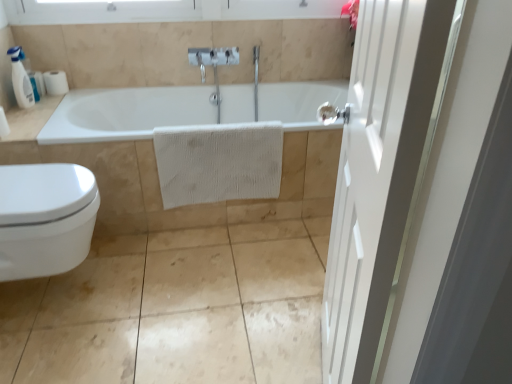
What do you see at coordinates (30, 119) in the screenshot?
I see `white glossy counter top at upper left` at bounding box center [30, 119].

Find the location of a particular element. The height and width of the screenshot is (384, 512). white glossy counter top at upper left is located at coordinates (30, 119).

Is white matte toilet paper at upper left positioned far away from white plastic soap dispenser at upper left?

No, white matte toilet paper at upper left is in close proximity to white plastic soap dispenser at upper left.

Is white matte toilet paper at upper left aimed at white plastic soap dispenser at upper left?

Yes, white matte toilet paper at upper left is oriented towards white plastic soap dispenser at upper left.

From the image's perspective, is white matte toilet paper at upper left located above or below white plastic soap dispenser at upper left?

white matte toilet paper at upper left is above white plastic soap dispenser at upper left.

Is white matte toilet paper at upper left closer to camera compared to white plastic soap dispenser at upper left?

No, white matte toilet paper at upper left is further to the viewer.

From the image's perspective, between white matte toilet paper at upper left and white wooden door at right, who is located below?

white wooden door at right, from the image's perspective.

Could you tell me if white matte toilet paper at upper left is turned towards white wooden door at right?

No, white matte toilet paper at upper left is not turned towards white wooden door at right.

Considering their positions, is white matte toilet paper at upper left located in front of or behind white wooden door at right?

Clearly, white matte toilet paper at upper left is behind white wooden door at right.

How different are the orientations of white matte toilet paper at upper left and white wooden door at right in degrees?

105 degrees.

Does white glossy bidet at lower left appear on the right side of white matte towel at center?

In fact, white glossy bidet at lower left is to the left of white matte towel at center.

Would you say white matte towel at center is part of white glossy bidet at lower left's contents?

No, white glossy bidet at lower left does not contain white matte towel at center.

Could you tell me if white glossy bidet at lower left is turned towards white matte towel at center?

No, white glossy bidet at lower left is not turned towards white matte towel at center.

Is point (57, 182) positioned in front of point (223, 206)?

Yes.

Is white plastic soap dispenser at upper left to the left of white glossy counter top at upper left from the viewer's perspective?

Yes, white plastic soap dispenser at upper left is to the left of white glossy counter top at upper left.

Find the location of `soap dispenser behind the white glossy counter top at upper left`. soap dispenser behind the white glossy counter top at upper left is located at coordinates (20, 79).

Does white plastic soap dispenser at upper left come behind white glossy counter top at upper left?

Yes, white plastic soap dispenser at upper left is behind white glossy counter top at upper left.

Would you say white plastic soap dispenser at upper left contains white glossy counter top at upper left?

Definitely not — white glossy counter top at upper left is not inside white plastic soap dispenser at upper left.

Who is taller, white wooden door at right or white glossy bidet at lower left?

With more height is white wooden door at right.

Is white wooden door at right located outside white glossy bidet at lower left?

That's correct, white wooden door at right is outside of white glossy bidet at lower left.

Is white wooden door at right to the left or to the right of white glossy bidet at lower left in the image?

Based on their positions, white wooden door at right is located to the right of white glossy bidet at lower left.

Is white wooden door at right completely or partially inside white glossy counter top at upper left?

Definitely not — white wooden door at right is not inside white glossy counter top at upper left.

Considering the sizes of objects white glossy counter top at upper left and white wooden door at right in the image provided, who is wider, white glossy counter top at upper left or white wooden door at right?

Wider between the two is white glossy counter top at upper left.

Find the location of a particular element. door located in front of the white glossy counter top at upper left is located at coordinates (381, 172).

Consider the image. Is white glossy counter top at upper left oriented away from white wooden door at right?

No, white glossy counter top at upper left's orientation is not away from white wooden door at right.

In the scene shown: Is white glossy counter top at upper left inside or outside of white matte towel at center?

white glossy counter top at upper left is not inside white matte towel at center, it's outside.

Which is in front, point (37, 103) or point (79, 121)?

The point (79, 121) is closer to the camera.

Is white glossy counter top at upper left smaller than white matte towel at center?

Yes, white glossy counter top at upper left is smaller than white matte towel at center.

From the image's perspective, which is below, white glossy counter top at upper left or white matte towel at center?

white matte towel at center, from the image's perspective.

Identify the location of soap dispenser lying on the left of white matte toilet paper at upper left. This screenshot has width=512, height=384. (20, 79).

In order to click on toilet paper that appears above the white wooden door at right (from the image's perspective) in this screenshot , I will do `click(55, 82)`.

Estimate the real-world distances between objects in this image. Which object is further from white plastic soap dispenser at upper left, white textured towel at center or white matte towel at center?

Among the two, white textured towel at center is located further to white plastic soap dispenser at upper left.

Considering their positions, is white plastic soap dispenser at upper left positioned further to white matte towel at center than white glossy bidet at lower left?

white plastic soap dispenser at upper left is positioned further to the anchor white matte towel at center.

Estimate the real-world distances between objects in this image. Which object is closer to white textured towel at center, white matte towel at center or white glossy counter top at upper left?

Based on the image, white matte towel at center appears to be nearer to white textured towel at center.

Looking at the image, which one is located closer to white textured towel at center, white glossy counter top at upper left or white wooden door at right?

white glossy counter top at upper left lies closer to white textured towel at center than the other object.

When comparing their distances from white matte toilet paper at upper left, does white glossy bidet at lower left or white plastic soap dispenser at upper left seem further?

white glossy bidet at lower left is further to white matte toilet paper at upper left.

Looking at the image, which one is located closer to white glossy counter top at upper left, white wooden door at right or white plastic soap dispenser at upper left?

Based on the image, white plastic soap dispenser at upper left appears to be nearer to white glossy counter top at upper left.

When comparing their distances from white wooden door at right, does white plastic soap dispenser at upper left or white textured towel at center seem further?

white plastic soap dispenser at upper left is further to white wooden door at right.

When comparing their distances from white matte toilet paper at upper left, does white textured towel at center or white glossy counter top at upper left seem further?

white textured towel at center lies further to white matte toilet paper at upper left than the other object.

Locate an element on the screen. This screenshot has height=384, width=512. bidet located between white wooden door at right and white matte toilet paper at upper left in the depth direction is located at coordinates (45, 218).

The image size is (512, 384). In order to click on bath towel between white wooden door at right and white matte toilet paper at upper left in the front-back direction in this screenshot , I will do `click(218, 162)`.

Identify the location of bath positioned between white wooden door at right and white matte toilet paper at upper left from near to far. (189, 124).

At what (x,y) coordinates should I click in order to perform the action: click on bidet situated between white matte toilet paper at upper left and white textured towel at center from left to right. Please return your answer as a coordinate pair (x, y). The width and height of the screenshot is (512, 384). Looking at the image, I should click on (45, 218).